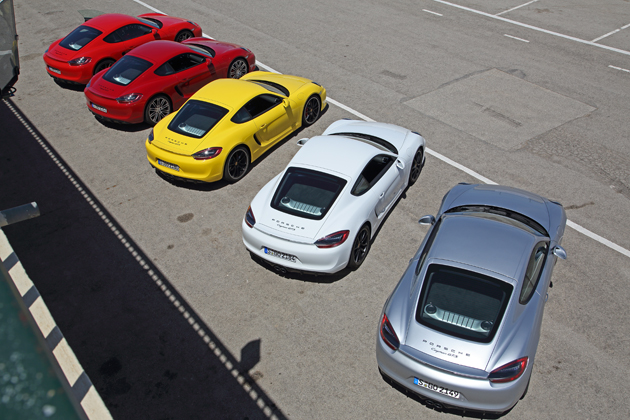
Locate an element on the screen. The image size is (630, 420). mirrors is located at coordinates pos(558,250), pos(424,221), pos(404,169), pos(302,137), pos(285,108), pos(152,32), pos(210,68).